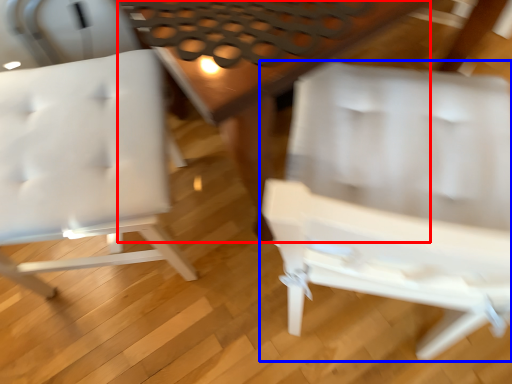
Question: Which object is closer to the camera taking this photo, table (highlighted by a red box) or chair (highlighted by a blue box)?

Choices:
 (A) table
 (B) chair

Answer: (B)